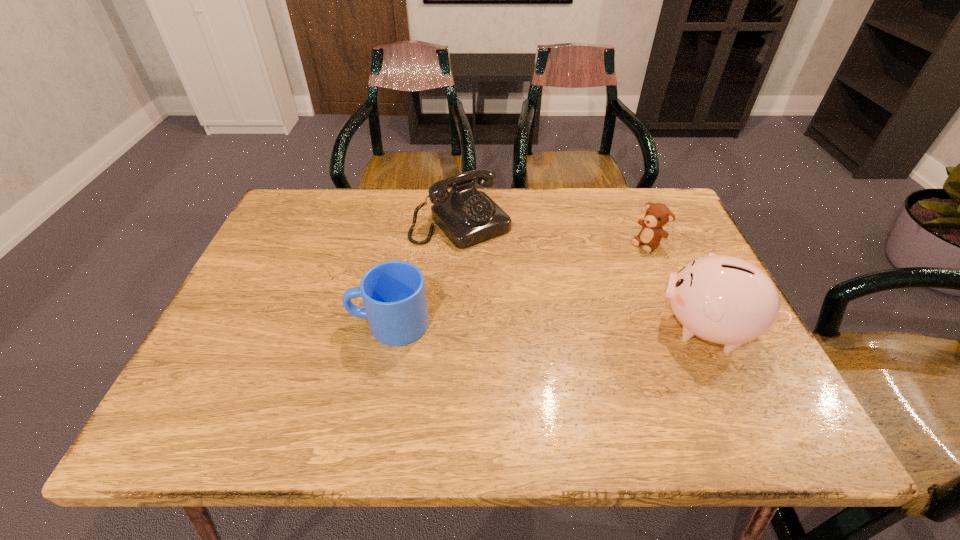
I want to click on vacant space situated 0.190m on the dial of the telephone, so click(x=526, y=289).

Identify the location of vacant space located 0.300m on the face of the teddy bear. The height and width of the screenshot is (540, 960). (564, 305).

Where is `vacant space positioned on the face of the teddy bear`? The image size is (960, 540). vacant space positioned on the face of the teddy bear is located at coordinates (603, 275).

The width and height of the screenshot is (960, 540). I want to click on vacant area located 0.100m on the face of the teddy bear, so click(x=615, y=267).

This screenshot has height=540, width=960. Identify the location of telephone that is at the far edge. (467, 217).

You are a GUI agent. You are given a task and a screenshot of the screen. Output one action in this format:
    pyautogui.click(x=<x>, y=<y>)
    Task: Click on the teddy bear that is at the far edge
    The height and width of the screenshot is (540, 960).
    Given the screenshot: What is the action you would take?
    pyautogui.click(x=657, y=215)

Find the location of a particular element. The width and height of the screenshot is (960, 540). object at the near edge is located at coordinates (723, 299).

This screenshot has height=540, width=960. Identify the location of piggy bank that is at the right edge. (723, 299).

Find the location of `teddy bear that is at the right edge`. teddy bear that is at the right edge is located at coordinates (657, 215).

At what (x,y) coordinates should I click in order to perform the action: click on object present at the far right corner. Please return your answer as a coordinate pair (x, y). The height and width of the screenshot is (540, 960). Looking at the image, I should click on (657, 215).